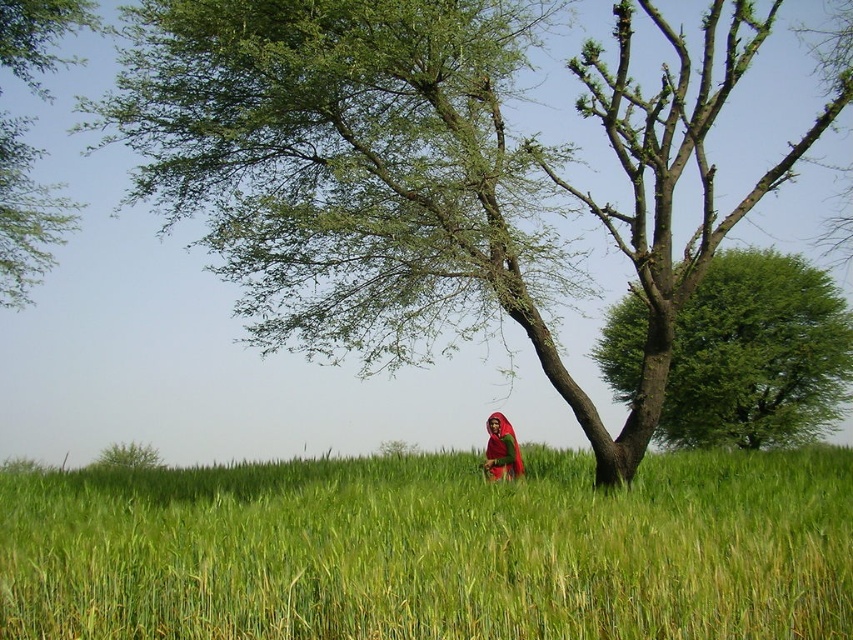
Looking at this image, you are navigating through the rural landscape and want to reach the point at coordinates point (764, 324). You are currently at point (67, 205). Which direction should you move to reach your destination?

Since point (764, 324) is behind point (67, 205), you should move in the direction away from your current position to reach the destination.

You are a farmer planning to plant a new row of crops in the field. The green leafy tree at center is in the way. To avoid its shadow, which direction should you plant the new row relative to the tree?

The green leafy tree at center is located at point (x=419, y=172). To avoid its shadow, you should plant the new row of crops in a direction away from the tree, such as to the north or south, depending on the tree location and sunlight direction. However, without specific sunlight direction data, the safest option is to plant perpendicular to the tree to minimize shadow overlap.